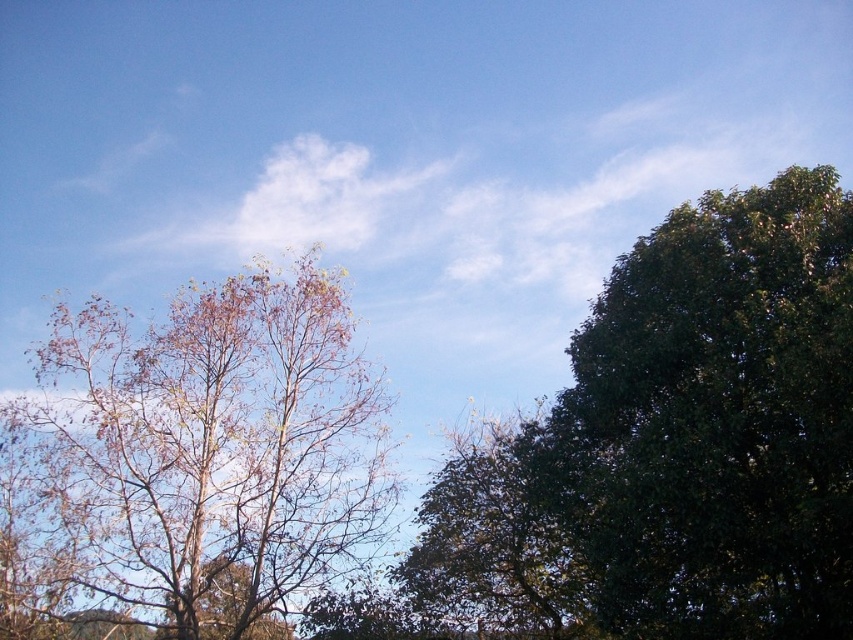
Is green leafy tree at right taller than brown leafy tree at left?

No, green leafy tree at right is not taller than brown leafy tree at left.

Is point (589, 388) positioned in front of point (357, 376)?

Yes, it is.

Where is `green leafy tree at right`? Image resolution: width=853 pixels, height=640 pixels. green leafy tree at right is located at coordinates click(x=714, y=422).